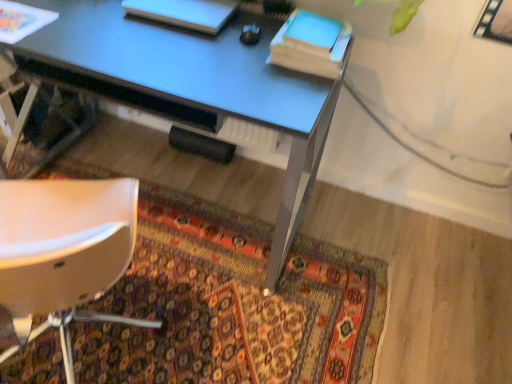
Question: Is blue matte notepad at upper right bigger than white matte book at upper center, marked as the second book in a right-to-left arrangement?

Choices:
 (A) yes
 (B) no

Answer: (B)

Question: Is blue matte notepad at upper right smaller than white matte book at upper center, the first book in the left-to-right sequence?

Choices:
 (A) yes
 (B) no

Answer: (A)

Question: Considering the relative sizes of blue matte notepad at upper right and white matte book at upper center, the first book in the left-to-right sequence, in the image provided, is blue matte notepad at upper right thinner than white matte book at upper center, the first book in the left-to-right sequence,?

Choices:
 (A) no
 (B) yes

Answer: (A)

Question: From the image's perspective, is blue matte notepad at upper right above white matte book at upper center, marked as the second book in a right-to-left arrangement?

Choices:
 (A) no
 (B) yes

Answer: (A)

Question: Is blue matte notepad at upper right touching white matte book at upper center, the first book in the left-to-right sequence?

Choices:
 (A) yes
 (B) no

Answer: (B)

Question: Can you confirm if blue matte notepad at upper right is shorter than white matte book at upper center, the first book in the left-to-right sequence?

Choices:
 (A) no
 (B) yes

Answer: (B)

Question: From a real-world perspective, is carpeted rug at lower center below metallic blue desk at center?

Choices:
 (A) yes
 (B) no

Answer: (A)

Question: Is carpeted rug at lower center surrounding metallic blue desk at center?

Choices:
 (A) no
 (B) yes

Answer: (A)

Question: Considering the relative sizes of carpeted rug at lower center and metallic blue desk at center in the image provided, is carpeted rug at lower center shorter than metallic blue desk at center?

Choices:
 (A) no
 (B) yes

Answer: (B)

Question: From a real-world perspective, is carpeted rug at lower center positioned over metallic blue desk at center based on gravity?

Choices:
 (A) no
 (B) yes

Answer: (A)

Question: Can you confirm if carpeted rug at lower center is positioned to the left of metallic blue desk at center?

Choices:
 (A) yes
 (B) no

Answer: (A)

Question: Considering the relative sizes of carpeted rug at lower center and metallic blue desk at center in the image provided, is carpeted rug at lower center smaller than metallic blue desk at center?

Choices:
 (A) yes
 (B) no

Answer: (A)

Question: Does blue matte notepad at upper right lie behind carpeted rug at lower center?

Choices:
 (A) yes
 (B) no

Answer: (A)